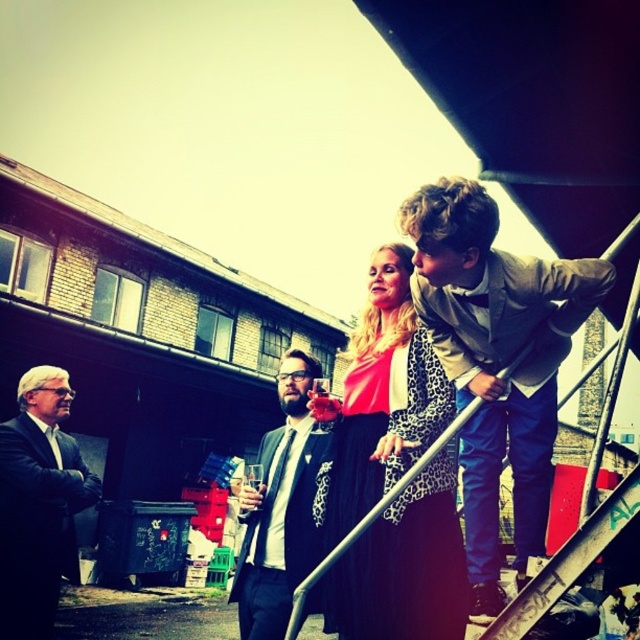
You are standing at the camera position and want to grab the light brown leather jacket at upper right. Can you reach it without moving your feet?

The light brown leather jacket at upper right is 8.55 feet away from the camera, so you cannot reach it without moving your feet.

You are standing at the bottom of the metal staircase and want to hand a note to the person wearing the leopard print dress at center. Which direction should you move to reach them first without passing through the light brown leather jacket at upper right?

You should move to the left side of the frame to reach the leopard print dress at center first, as the light brown leather jacket at upper right is located above them and not blocking their direct path from the staircase.

You are a photographer trying to capture a group photo of the leopard print dress at center and the matte black suit at center. Which of the two should you position closer to the camera to ensure both appear equally tall in the photo?

Since the leopard print dress at center is taller than the matte black suit at center, you should position the matte black suit at center closer to the camera so that both appear equally tall in the photo.